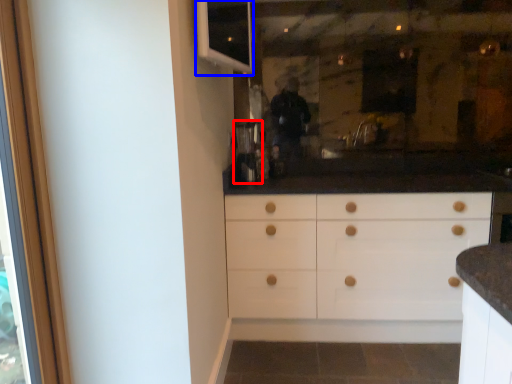
Question: Which point is further to the camera, coffee machine (highlighted by a red box) or window (highlighted by a blue box)?

Choices:
 (A) coffee machine
 (B) window

Answer: (A)